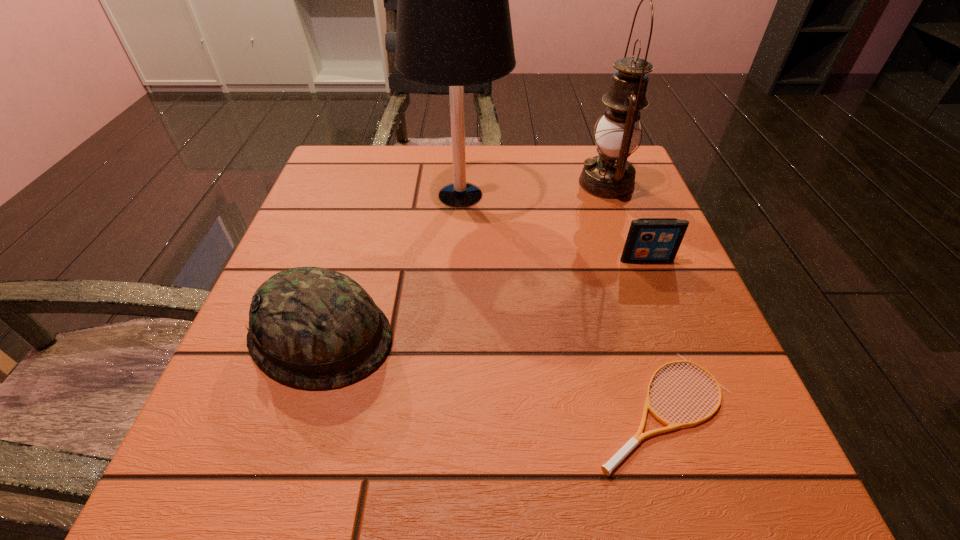
What are the coordinates of `vacant space at the far edge of the desktop` in the screenshot? It's located at (552, 167).

In the image, there is a desktop. Where is `vacant space at the near edge`? The image size is (960, 540). vacant space at the near edge is located at coordinates (355, 437).

Identify the location of vacant space at the left edge of the desktop. (245, 334).

In order to click on vacant space at the right edge in this screenshot , I will do `click(632, 215)`.

Locate an element on the screen. This screenshot has height=540, width=960. vacant area at the far left corner of the desktop is located at coordinates (382, 195).

Where is `free location at the near left corner of the desktop`? The height and width of the screenshot is (540, 960). free location at the near left corner of the desktop is located at coordinates [x=282, y=503].

The image size is (960, 540). In order to click on vacant space at the near right corner of the desktop in this screenshot , I will do `click(685, 492)`.

Identify the location of free space between the oil lamp and the second shortest object. (626, 221).

You are a GUI agent. You are given a task and a screenshot of the screen. Output one action in this format:
    pyautogui.click(x=<x>, y=<y>)
    Task: Click on the empty location between the oil lamp and the second shortest object
    The image size is (960, 540).
    Given the screenshot: What is the action you would take?
    pyautogui.click(x=626, y=221)

This screenshot has height=540, width=960. Find the location of `vacant space in between the oil lamp and the third nearest object`. vacant space in between the oil lamp and the third nearest object is located at coordinates (626, 221).